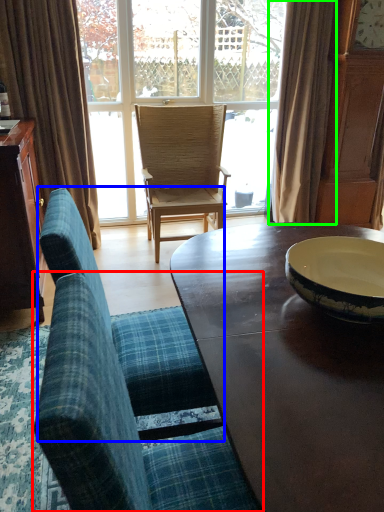
Question: Which is farther away from chair (highlighted by a red box)? chair (highlighted by a blue box) or curtain (highlighted by a green box)?

Choices:
 (A) chair
 (B) curtain

Answer: (B)